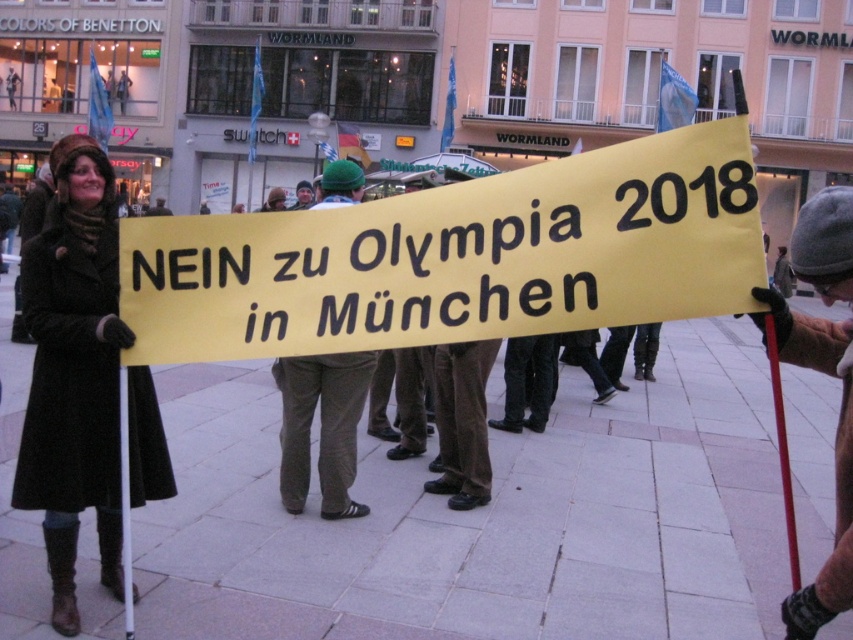
Does matte black coat at left have a greater width compared to gray woolen hat at right?

Incorrect, matte black coat at left's width does not surpass gray woolen hat at right's.

Can you confirm if matte black coat at left is shorter than gray woolen hat at right?

Yes.

Locate an element on the screen. This screenshot has width=853, height=640. matte black coat at left is located at coordinates (73, 372).

Does gray woolen hat at right appear on the left side of green knit cap at center?

No, gray woolen hat at right is not to the left of green knit cap at center.

Between gray woolen hat at right and green knit cap at center, which one is positioned higher?

green knit cap at center is above.

Who is more distant from viewer, [776,337] or [303,193]?

The point [303,193] is behind.

Identify the location of gray woolen hat at right. The height and width of the screenshot is (640, 853). (833, 458).

Describe the element at coordinates (73, 372) in the screenshot. The width and height of the screenshot is (853, 640). I see `matte black coat at left` at that location.

Which is below, matte black coat at left or khaki corduroy pants at center?

khaki corduroy pants at center is lower down.

Image resolution: width=853 pixels, height=640 pixels. Describe the element at coordinates (73, 372) in the screenshot. I see `matte black coat at left` at that location.

Identify the location of matte black coat at left. Image resolution: width=853 pixels, height=640 pixels. (73, 372).